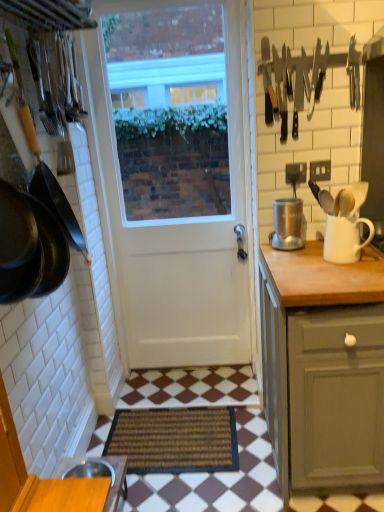
The height and width of the screenshot is (512, 384). Find the location of `free space to the left of white glossy jug at right`. free space to the left of white glossy jug at right is located at coordinates (301, 260).